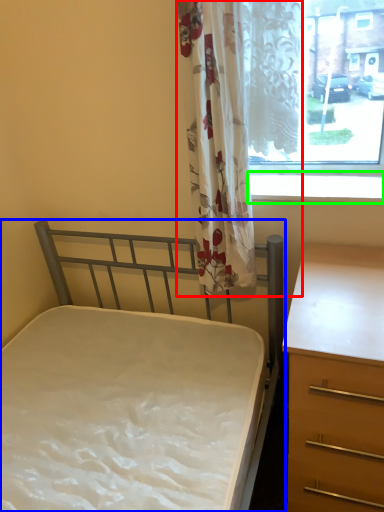
Question: Considering the real-world distances, which object is closest to curtain (highlighted by a red box)? bed (highlighted by a blue box) or window sill (highlighted by a green box).

Choices:
 (A) bed
 (B) window sill

Answer: (B)